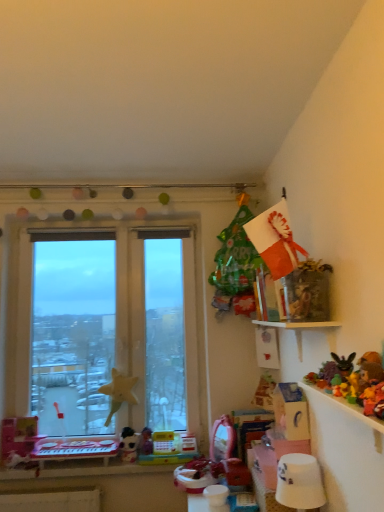
Question: In the image, is white plush toy at lower center, which is the first toy from bottom to top, positioned in front of or behind multicolored plastic toy at upper right, the 2th toy viewed from the left?

Choices:
 (A) behind
 (B) front

Answer: (A)

Question: From a real-world perspective, relative to multicolored plastic toy at upper right, positioned as the 3th toy in top-to-bottom order, is white plush toy at lower center, positioned as the 1th toy in back-to-front order, vertically above or below?

Choices:
 (A) above
 (B) below

Answer: (B)

Question: Based on their relative distances, which object is farther from the fluffy yellow teddy bear at upper right, which is counted as the fourth toy, starting from the left?

Choices:
 (A) multicolored plastic toy at upper right, positioned as the 3th toy in top-to-bottom order
 (B) transparent glass window at left
 (C) white glossy lampshade at lower right
 (D) white plush toy at lower center, which is counted as the fourth toy, starting from the right
 (E) plush yellow rabbit at upper right, placed as the 3th toy when sorted from left to right

Answer: (B)

Question: Which object is the farthest from the white plush toy at lower center, arranged as the first toy when viewed from the left?

Choices:
 (A) plush yellow rabbit at upper right, the fourth toy from the back
 (B) multicolored plastic toy at upper right, the second toy from the back
 (C) white glossy lampshade at lower right
 (D) white plastic table at lower left
 (E) transparent glass window at left

Answer: (A)